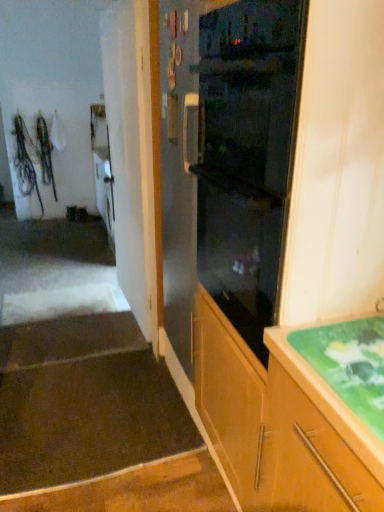
What do you see at coordinates (245, 153) in the screenshot? I see `black glass oven at center` at bounding box center [245, 153].

What is the approximate height of green glossy countertop at lower right?

green glossy countertop at lower right is 1.90 inches in height.

This screenshot has height=512, width=384. What do you see at coordinates (84, 402) in the screenshot? I see `dark brown carpet at lower left, the first stairwell viewed from the front` at bounding box center [84, 402].

Locate an element on the screen. This screenshot has height=512, width=384. black glass oven at center is located at coordinates (245, 153).

Is the position of dark brown carpet at lower left, positioned as the second stairwell in back-to-front order, more distant than that of green glossy countertop at lower right?

Yes, the depth of dark brown carpet at lower left, positioned as the second stairwell in back-to-front order, is greater than that of green glossy countertop at lower right.

Is dark brown carpet at lower left, the first stairwell viewed from the front, looking in the opposite direction of green glossy countertop at lower right?

dark brown carpet at lower left, the first stairwell viewed from the front, is not turned away from green glossy countertop at lower right.

Would you say dark brown carpet at lower left, positioned as the second stairwell in back-to-front order, is to the left or to the right of green glossy countertop at lower right in the picture?

In the image, dark brown carpet at lower left, positioned as the second stairwell in back-to-front order, appears on the left side of green glossy countertop at lower right.

Identify the location of home appliance behind the green glossy countertop at lower right. The image size is (384, 512). (245, 153).

Can you confirm if black glass oven at center is taller than green glossy countertop at lower right?

Yes, black glass oven at center is taller than green glossy countertop at lower right.

Can we say black glass oven at center lies outside green glossy countertop at lower right?

Indeed, black glass oven at center is completely outside green glossy countertop at lower right.

Is black glass oven at center further to the viewer compared to green glossy countertop at lower right?

Yes, black glass oven at center is further from the camera.

Which of these two, brown carpet at lower left, the first stairwell in the back-to-front sequence, or green glossy countertop at lower right, is bigger?

With larger size is brown carpet at lower left, the first stairwell in the back-to-front sequence.

Is brown carpet at lower left, the first stairwell in the back-to-front sequence, positioned beyond the bounds of green glossy countertop at lower right?

Absolutely, brown carpet at lower left, the first stairwell in the back-to-front sequence, is external to green glossy countertop at lower right.

Find the location of a particular element. stairwell that is the 2nd one when counting backward from the green glossy countertop at lower right is located at coordinates click(x=68, y=339).

Does brown carpet at lower left, the first stairwell in the back-to-front sequence, come behind green glossy countertop at lower right?

Yes, it is.

Do you think black glass oven at center is within brown carpet at lower left, the first stairwell in the back-to-front sequence, or outside of it?

black glass oven at center is not inside brown carpet at lower left, the first stairwell in the back-to-front sequence, it's outside.

Can you tell me how much black glass oven at center and brown carpet at lower left, the first stairwell in the back-to-front sequence, differ in facing direction?

The angle between the facing direction of black glass oven at center and the facing direction of brown carpet at lower left, the first stairwell in the back-to-front sequence, is 90.2 degrees.

Is black glass oven at center taller than brown carpet at lower left, the 2th stairwell positioned from the front?

Yes.

Would you say green glossy countertop at lower right is a long distance from dark brown carpet at lower left, positioned as the second stairwell in back-to-front order?

Yes, green glossy countertop at lower right and dark brown carpet at lower left, positioned as the second stairwell in back-to-front order, are quite far apart.

From the image's perspective, is green glossy countertop at lower right above or below dark brown carpet at lower left, positioned as the second stairwell in back-to-front order?

green glossy countertop at lower right is above dark brown carpet at lower left, positioned as the second stairwell in back-to-front order.

Is green glossy countertop at lower right thinner than dark brown carpet at lower left, the first stairwell viewed from the front?

Correct, the width of green glossy countertop at lower right is less than that of dark brown carpet at lower left, the first stairwell viewed from the front.

How many degrees apart are the facing directions of dark brown carpet at lower left, positioned as the second stairwell in back-to-front order, and brown carpet at lower left, the 2th stairwell positioned from the front?

They differ by 0.289 degrees in their facing directions.

Locate an element on the screen. Image resolution: width=384 pixels, height=512 pixels. stairwell above the brown carpet at lower left, the 2th stairwell positioned from the front (from a real-world perspective) is located at coordinates (84, 402).

Considering the sizes of dark brown carpet at lower left, positioned as the second stairwell in back-to-front order, and brown carpet at lower left, the first stairwell in the back-to-front sequence, in the image, is dark brown carpet at lower left, positioned as the second stairwell in back-to-front order, bigger or smaller than brown carpet at lower left, the first stairwell in the back-to-front sequence,?

Considering their sizes, dark brown carpet at lower left, positioned as the second stairwell in back-to-front order, takes up more space than brown carpet at lower left, the first stairwell in the back-to-front sequence.

Which is in front, dark brown carpet at lower left, the first stairwell viewed from the front, or brown carpet at lower left, the first stairwell in the back-to-front sequence?

dark brown carpet at lower left, the first stairwell viewed from the front.

Image resolution: width=384 pixels, height=512 pixels. What are the coordinates of `the 2nd stairwell behind the green glossy countertop at lower right` in the screenshot? It's located at (68, 339).

Is the position of green glossy countertop at lower right more distant than that of brown carpet at lower left, the 2th stairwell positioned from the front?

That is False.

How different are the orientations of green glossy countertop at lower right and brown carpet at lower left, the 2th stairwell positioned from the front, in degrees?

89 degrees separate the facing orientations of green glossy countertop at lower right and brown carpet at lower left, the 2th stairwell positioned from the front.

At what (x,y) coordinates should I click in order to perform the action: click on countertop in front of the dark brown carpet at lower left, positioned as the second stairwell in back-to-front order. Please return your answer as a coordinate pair (x, y). Looking at the image, I should click on (344, 366).

Where is `countertop directly beneath the black glass oven at center (from a real-world perspective)`? countertop directly beneath the black glass oven at center (from a real-world perspective) is located at coordinates (344, 366).

Considering their positions, is dark brown carpet at lower left, positioned as the second stairwell in back-to-front order, positioned further to green glossy countertop at lower right than black glass oven at center?

dark brown carpet at lower left, positioned as the second stairwell in back-to-front order, is further to green glossy countertop at lower right.

Considering their positions, is green glossy countertop at lower right positioned closer to dark brown carpet at lower left, positioned as the second stairwell in back-to-front order, than black glass oven at center?

Among the two, black glass oven at center is located nearer to dark brown carpet at lower left, positioned as the second stairwell in back-to-front order.

Considering their positions, is brown carpet at lower left, the first stairwell in the back-to-front sequence, positioned closer to dark brown carpet at lower left, the first stairwell viewed from the front, than green glossy countertop at lower right?

Based on the image, brown carpet at lower left, the first stairwell in the back-to-front sequence, appears to be nearer to dark brown carpet at lower left, the first stairwell viewed from the front.

Looking at the image, which one is located further to green glossy countertop at lower right, black glass oven at center or brown carpet at lower left, the 2th stairwell positioned from the front?

The object further to green glossy countertop at lower right is brown carpet at lower left, the 2th stairwell positioned from the front.

From the image, which object appears to be farther from brown carpet at lower left, the first stairwell in the back-to-front sequence, dark brown carpet at lower left, positioned as the second stairwell in back-to-front order, or black glass oven at center?

black glass oven at center is positioned further to the anchor brown carpet at lower left, the first stairwell in the back-to-front sequence.

Based on their spatial positions, is brown carpet at lower left, the first stairwell in the back-to-front sequence, or dark brown carpet at lower left, positioned as the second stairwell in back-to-front order, closer to green glossy countertop at lower right?

dark brown carpet at lower left, positioned as the second stairwell in back-to-front order, is positioned closer to the anchor green glossy countertop at lower right.

Based on their spatial positions, is green glossy countertop at lower right or dark brown carpet at lower left, positioned as the second stairwell in back-to-front order, closer to brown carpet at lower left, the first stairwell in the back-to-front sequence?

Based on the image, dark brown carpet at lower left, positioned as the second stairwell in back-to-front order, appears to be nearer to brown carpet at lower left, the first stairwell in the back-to-front sequence.

Looking at the image, which one is located closer to green glossy countertop at lower right, dark brown carpet at lower left, positioned as the second stairwell in back-to-front order, or brown carpet at lower left, the 2th stairwell positioned from the front?

The object closer to green glossy countertop at lower right is dark brown carpet at lower left, positioned as the second stairwell in back-to-front order.

Identify the location of home appliance between green glossy countertop at lower right and brown carpet at lower left, the 2th stairwell positioned from the front, along the z-axis. This screenshot has width=384, height=512. (245, 153).

Identify the location of stairwell positioned between green glossy countertop at lower right and brown carpet at lower left, the first stairwell in the back-to-front sequence, from near to far. The height and width of the screenshot is (512, 384). (84, 402).

Identify the location of stairwell between black glass oven at center and brown carpet at lower left, the 2th stairwell positioned from the front, from front to back. (84, 402).

Identify the location of home appliance between green glossy countertop at lower right and dark brown carpet at lower left, the first stairwell viewed from the front, from front to back. (245, 153).